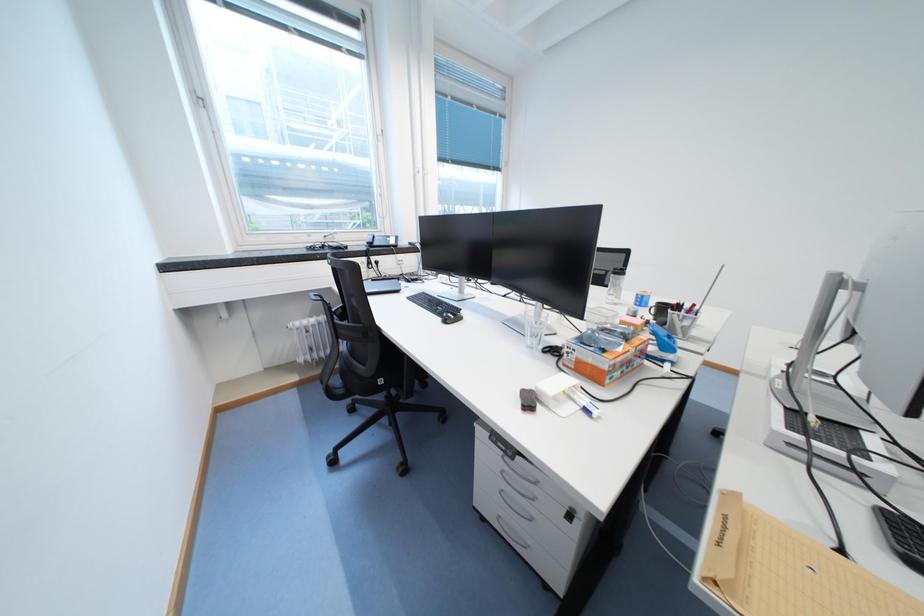
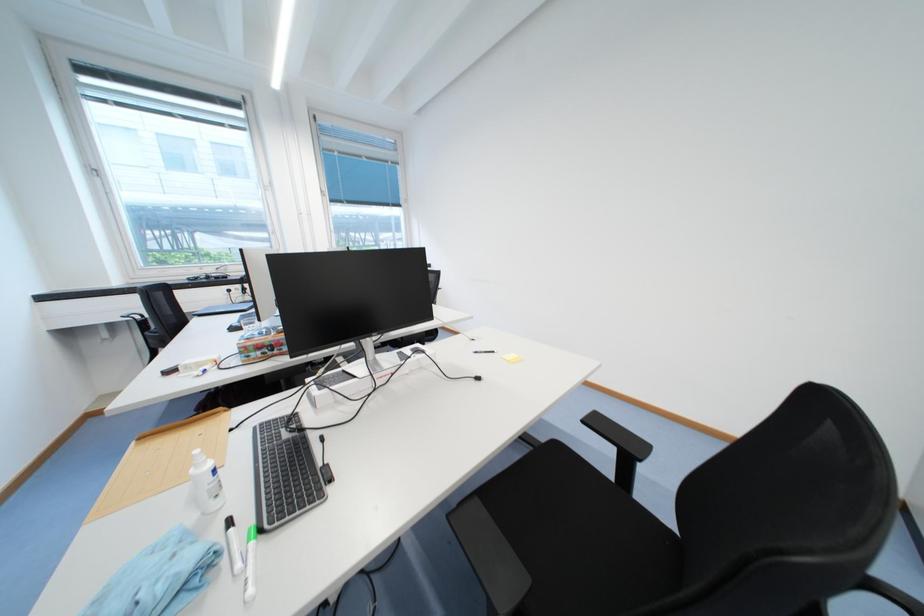
Question: In a continuous first-person perspective shot, in which direction is the camera moving?

Choices:
 (A) Left
 (B) Right
 (C) Forward
 (D) Backward

Answer: (B)